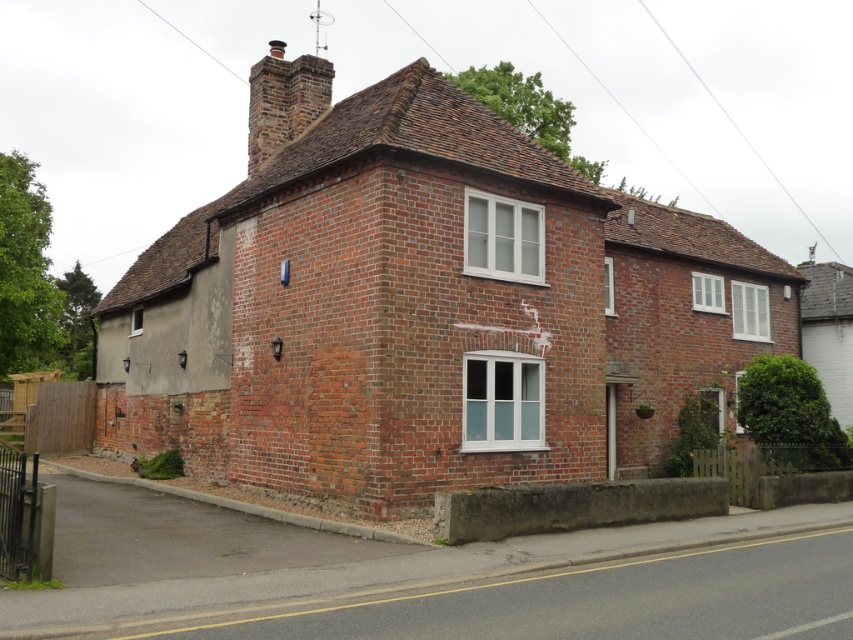
This screenshot has height=640, width=853. What do you see at coordinates (427, 314) in the screenshot?
I see `red brick house at center` at bounding box center [427, 314].

Is point (119, 296) positioned after point (846, 365)?

Yes, it is behind point (846, 365).

I want to click on red brick house at center, so click(427, 314).

Which of these two, red brick house at center or brick chimney at upper center, stands shorter?

With less height is red brick house at center.

Is red brick house at center behind brick chimney at upper center?

No, it is not.

Is point (630, 294) positioned behind point (258, 157)?

Yes, it is.

At what (x,y) coordinates should I click in order to perform the action: click on red brick house at center. Please return your answer as a coordinate pair (x, y). Looking at the image, I should click on 427,314.

Does brick chimney at upper center have a greater height compared to gray concrete chimney at upper right?

Correct, brick chimney at upper center is much taller as gray concrete chimney at upper right.

Can you confirm if brick chimney at upper center is smaller than gray concrete chimney at upper right?

Incorrect, brick chimney at upper center is not smaller in size than gray concrete chimney at upper right.

Between point (260, 74) and point (815, 291), which one is positioned behind?

Positioned behind is point (815, 291).

Locate an element on the screen. The image size is (853, 640). brick chimney at upper center is located at coordinates (283, 99).